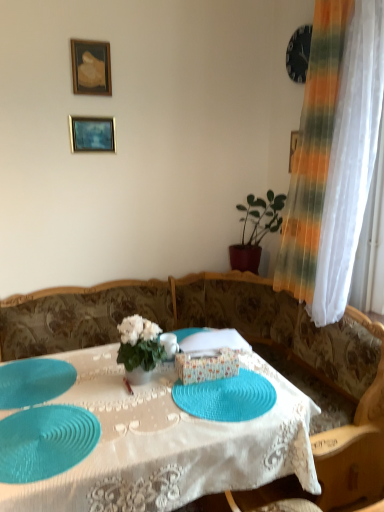
This screenshot has width=384, height=512. Find the location of `vacant area that is in front of teal rubber placemat at lower left, positioned as the 1th glass plate in left-to-right order`. vacant area that is in front of teal rubber placemat at lower left, positioned as the 1th glass plate in left-to-right order is located at coordinates [x=41, y=431].